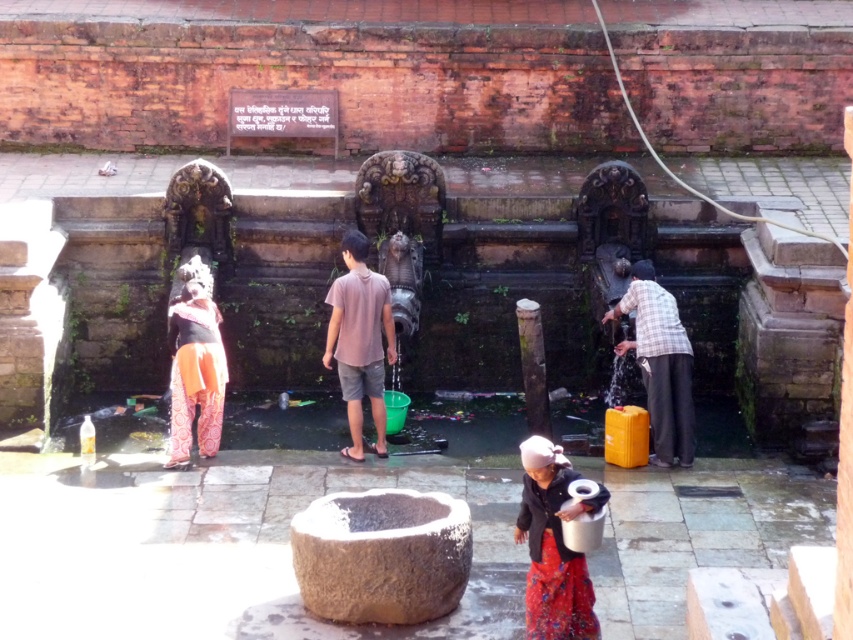
Question: Is red fabric skirt at lower center smaller than orange printed pants at center?

Choices:
 (A) yes
 (B) no

Answer: (A)

Question: Is red fabric skirt at lower center above orange printed pants at center?

Choices:
 (A) yes
 (B) no

Answer: (B)

Question: Can you confirm if red fabric skirt at lower center is bigger than orange printed pants at center?

Choices:
 (A) no
 (B) yes

Answer: (A)

Question: Which object is farther from the camera taking this photo?

Choices:
 (A) orange printed pants at center
 (B) red fabric skirt at lower center

Answer: (A)

Question: Among these objects, which one is farthest from the camera?

Choices:
 (A) red fabric skirt at lower center
 (B) orange printed pants at center

Answer: (B)